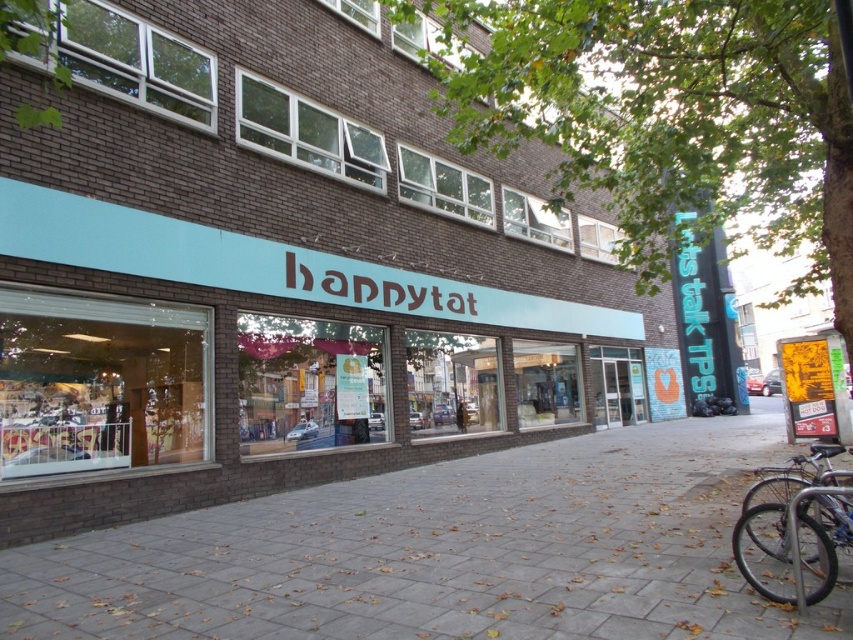
Question: Can you confirm if gray brick pavement at center is positioned to the right of silver metallic bicycle at lower right?

Choices:
 (A) yes
 (B) no

Answer: (B)

Question: Which point is closer to the camera?

Choices:
 (A) (350, 20)
 (B) (752, 557)
 (C) (436, 506)

Answer: (B)

Question: Based on their relative distances, which object is nearer to the gray brick pavement at center?

Choices:
 (A) silver metallic bicycle at lower right
 (B) matte teal signboard at center

Answer: (A)

Question: Can you confirm if gray brick pavement at center is positioned below silver metallic bicycle at lower right?

Choices:
 (A) yes
 (B) no

Answer: (A)

Question: Which point is farther to the camera?

Choices:
 (A) gray brick pavement at center
 (B) matte teal signboard at center
 (C) silver metallic bicycle at lower right

Answer: (B)

Question: Is matte teal signboard at center to the left of silver metallic bicycle at lower right from the viewer's perspective?

Choices:
 (A) no
 (B) yes

Answer: (B)